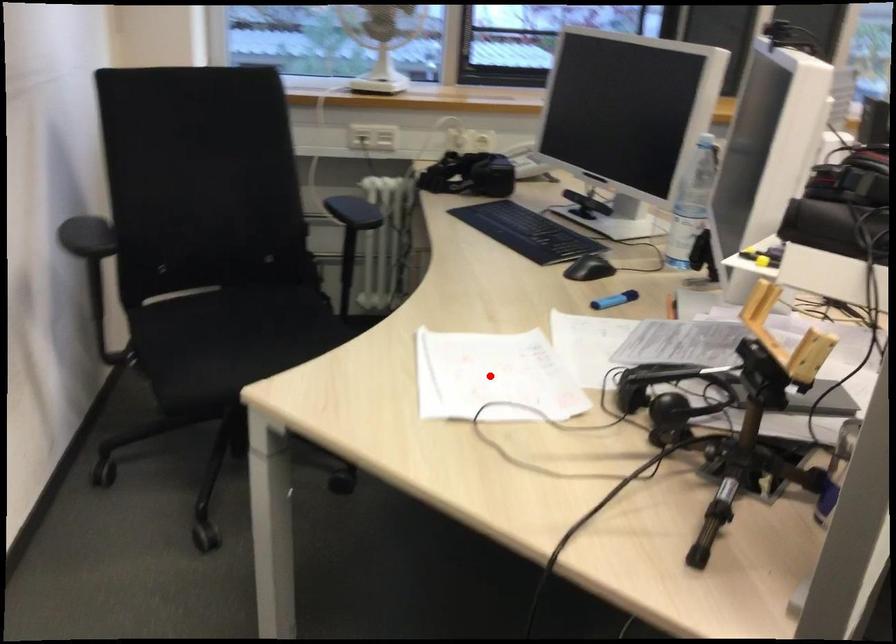
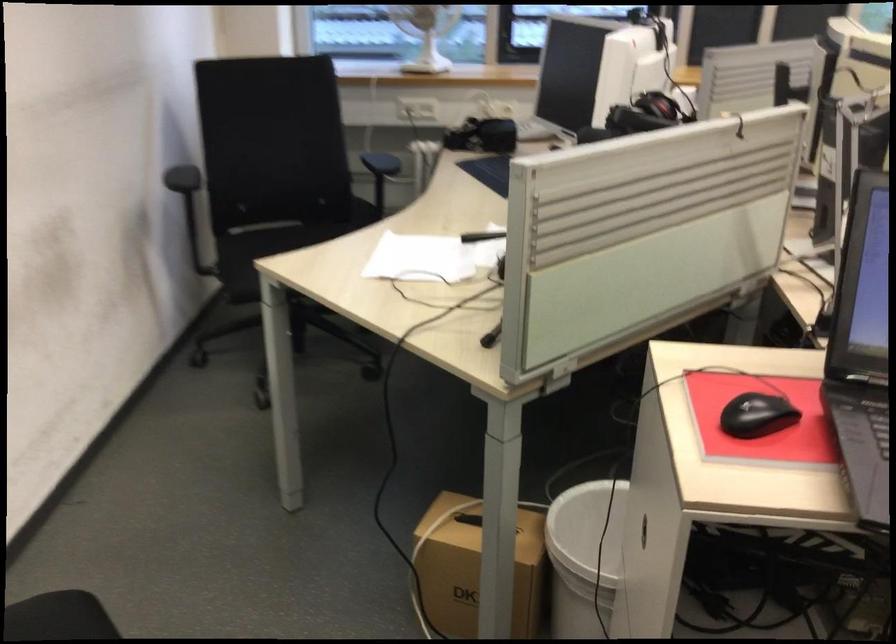
Question: A red point is marked in image1. In image2, is the corresponding 3D point closer to the camera or farther? Reply with the corresponding letter.

Choices:
 (A) The corresponding 3D point is closer.
 (B) The corresponding 3D point is farther.

Answer: (B)